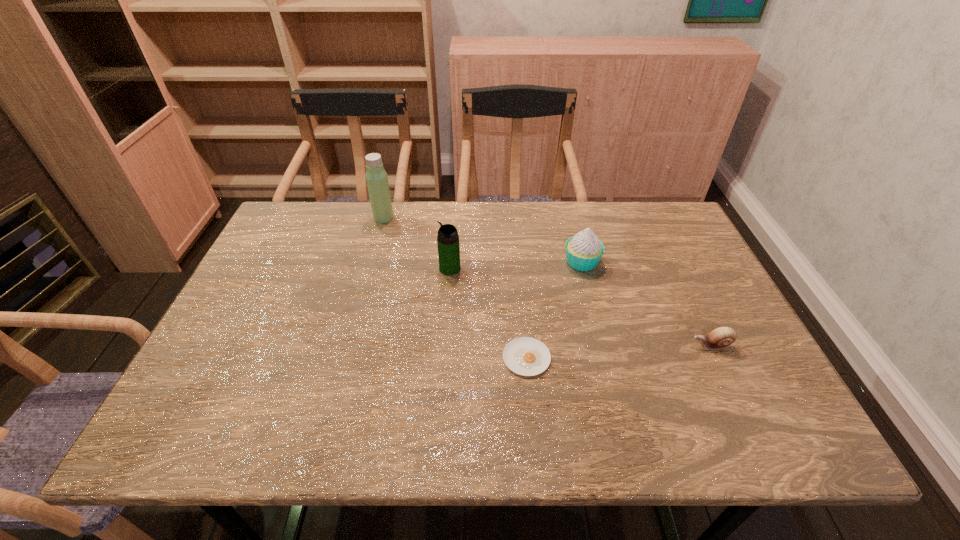
Locate an element on the screen. The width and height of the screenshot is (960, 540). free space located 0.200m on the left of the left thermos bottle is located at coordinates (311, 218).

At what (x,y) coordinates should I click in order to perform the action: click on vacant position located from the spout of the fourth shortest object. Please return your answer as a coordinate pair (x, y). The image size is (960, 540). Looking at the image, I should click on (356, 268).

Where is `vacant space located 0.120m from the spout of the fourth shortest object`? The width and height of the screenshot is (960, 540). vacant space located 0.120m from the spout of the fourth shortest object is located at coordinates (396, 268).

The image size is (960, 540). Find the location of `vacant position located 0.260m from the spout of the fourth shortest object`. vacant position located 0.260m from the spout of the fourth shortest object is located at coordinates (346, 268).

Locate an element on the screen. Image resolution: width=960 pixels, height=540 pixels. free point located on the back of the cupcake is located at coordinates (569, 214).

The width and height of the screenshot is (960, 540). What are the coordinates of `free space located on the front-facing side of the second shortest object` in the screenshot? It's located at (549, 345).

Find the location of a particular element. vacant space situated on the front-facing side of the second shortest object is located at coordinates (549, 345).

Identify the location of vacant space located on the front-facing side of the second shortest object. (540, 345).

Locate an element on the screen. This screenshot has height=540, width=960. vacant region located 0.120m on the front of the egg yolk is located at coordinates (533, 429).

Image resolution: width=960 pixels, height=540 pixels. I want to click on object at the far edge, so click(376, 177).